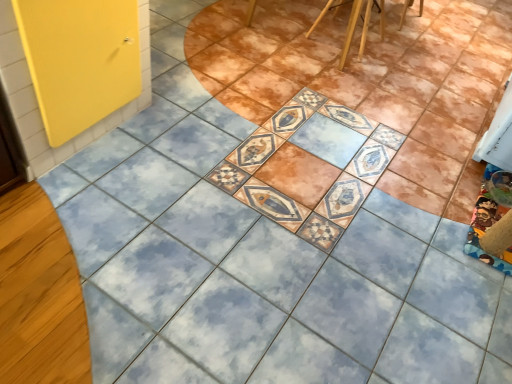
Question: Is the depth of yellow matte door at left less than that of wooden chair at upper center?

Choices:
 (A) yes
 (B) no

Answer: (A)

Question: Is yellow matte door at left thinner than wooden chair at upper center?

Choices:
 (A) no
 (B) yes

Answer: (A)

Question: Can you confirm if yellow matte door at left is shorter than wooden chair at upper center?

Choices:
 (A) no
 (B) yes

Answer: (A)

Question: Is wooden chair at upper center inside yellow matte door at left?

Choices:
 (A) yes
 (B) no

Answer: (B)

Question: From a real-world perspective, is yellow matte door at left positioned under wooden chair at upper center based on gravity?

Choices:
 (A) no
 (B) yes

Answer: (A)

Question: Is wooden chair at upper center bigger or smaller than yellow matte door at left?

Choices:
 (A) big
 (B) small

Answer: (B)

Question: Would you say wooden chair at upper center is to the left or to the right of yellow matte door at left in the picture?

Choices:
 (A) left
 (B) right

Answer: (B)

Question: From a real-world perspective, is wooden chair at upper center positioned above or below yellow matte door at left?

Choices:
 (A) above
 (B) below

Answer: (B)

Question: From the image's perspective, is wooden chair at upper center positioned above or below yellow matte door at left?

Choices:
 (A) below
 (B) above

Answer: (B)

Question: In the image, is wooden chair at upper center positioned in front of or behind wooden chair at upper center?

Choices:
 (A) behind
 (B) front

Answer: (A)

Question: From the image's perspective, is wooden chair at upper center located above or below wooden chair at upper center?

Choices:
 (A) above
 (B) below

Answer: (B)

Question: Is wooden chair at upper center bigger or smaller than wooden chair at upper center?

Choices:
 (A) big
 (B) small

Answer: (B)

Question: Is point (379, 23) positioned closer to the camera than point (352, 26)?

Choices:
 (A) closer
 (B) farther

Answer: (B)

Question: From the image's perspective, is wooden chair at upper center located above or below wooden chair at upper center?

Choices:
 (A) below
 (B) above

Answer: (B)

Question: Considering the positions of point (408, 6) and point (380, 13), is point (408, 6) closer or farther from the camera than point (380, 13)?

Choices:
 (A) closer
 (B) farther

Answer: (B)